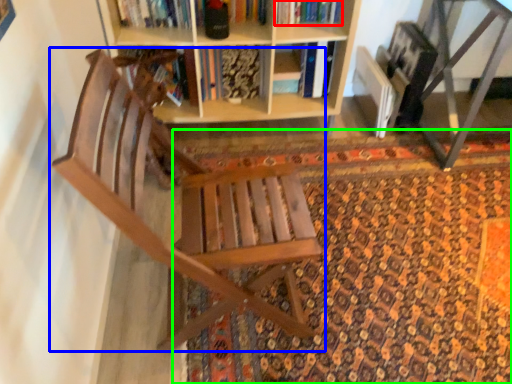
Question: Which object is positioned farthest from book (highlighted by a red box)? Select from chair (highlighted by a blue box) and doormat (highlighted by a green box).

Choices:
 (A) chair
 (B) doormat

Answer: (A)